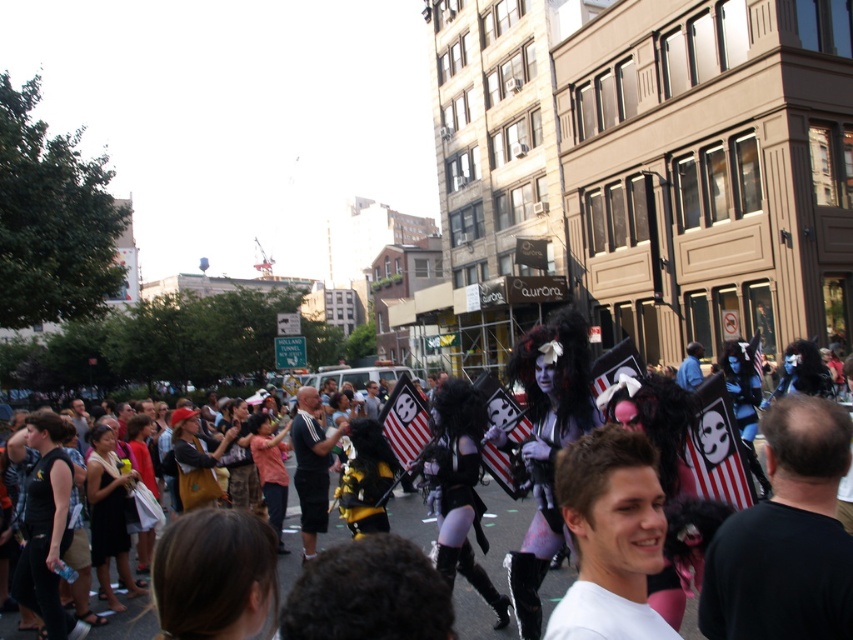
Question: Which object is closer to the camera taking this photo?

Choices:
 (A) black glossy mask at center
 (B) black matte t-shirt at center

Answer: (A)

Question: Is the position of black fabric mask at center more distant than that of white matte shirt at center?

Choices:
 (A) yes
 (B) no

Answer: (A)

Question: Which object is closer to the camera taking this photo?

Choices:
 (A) black fabric mask at center
 (B) striped fabric flag at center

Answer: (A)

Question: Does white paper flag at center come in front of striped fabric flag at center?

Choices:
 (A) no
 (B) yes

Answer: (B)

Question: Which point is closer to the camera taking this photo?

Choices:
 (A) (322, 444)
 (B) (740, 444)
 (C) (485, 604)
 (D) (422, 413)

Answer: (B)

Question: Does white matte shirt at center lie behind white paper flag at center?

Choices:
 (A) yes
 (B) no

Answer: (B)